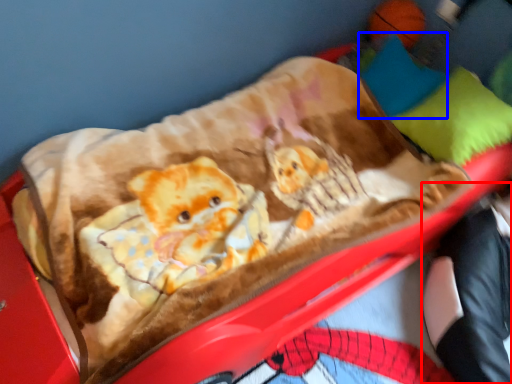
Question: Which object appears farthest to the camera in this image, couple (highlighted by a red box) or pillow (highlighted by a blue box)?

Choices:
 (A) couple
 (B) pillow

Answer: (B)